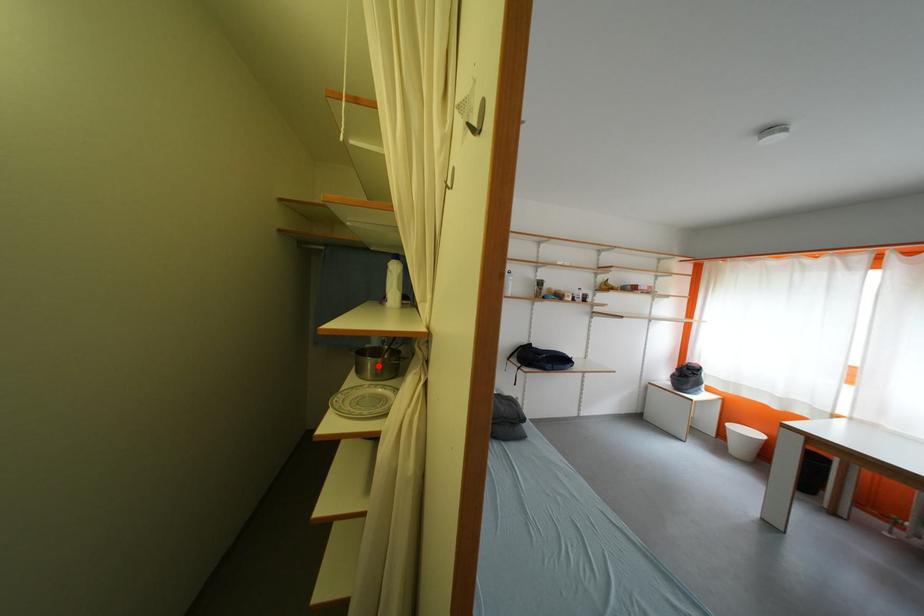
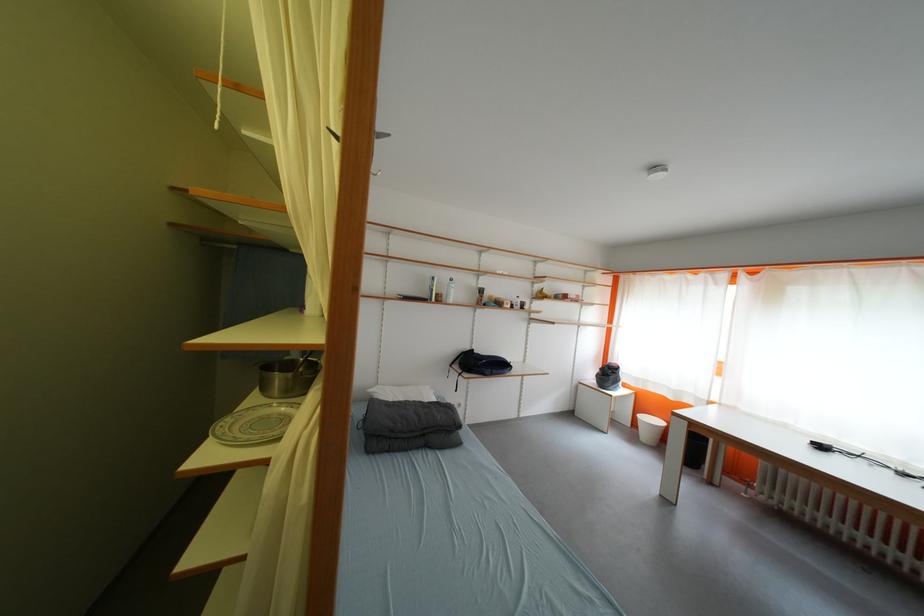
In the second image, find the point that corresponds to the highlighted location in the first image.

(286, 382)